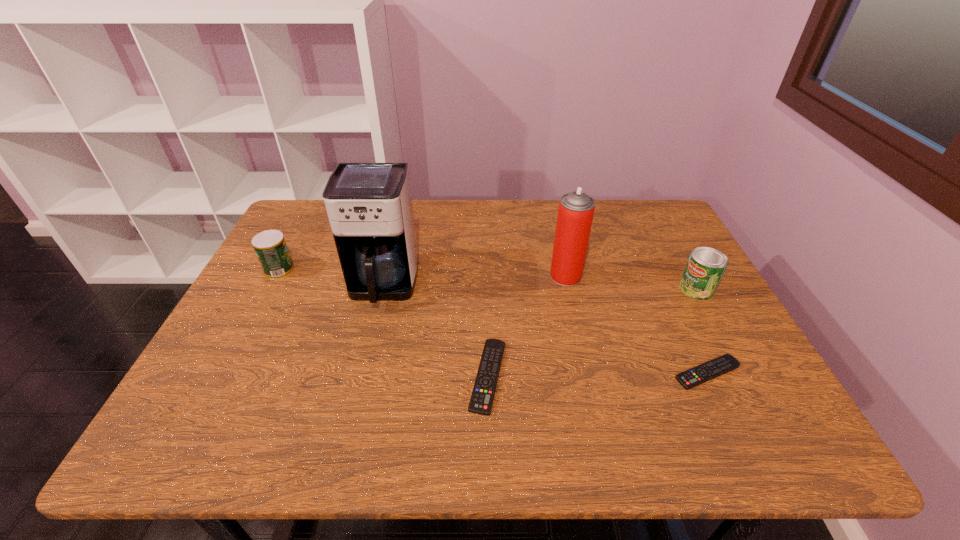
The image size is (960, 540). Identify the location of the taller remote control. (483, 393).

Find the location of a particular element. The height and width of the screenshot is (540, 960). the second shortest object is located at coordinates (483, 393).

Locate an element on the screen. The width and height of the screenshot is (960, 540). the right remote control is located at coordinates (707, 371).

At what (x,y) coordinates should I click in order to perform the action: click on the shortest object. Please return your answer as a coordinate pair (x, y). This screenshot has width=960, height=540. Looking at the image, I should click on (707, 371).

Where is `coffee maker`? coffee maker is located at coordinates (369, 205).

This screenshot has height=540, width=960. I want to click on the fifth shortest object, so click(x=576, y=209).

The image size is (960, 540). I want to click on the fourth object from left to right, so click(x=576, y=209).

Image resolution: width=960 pixels, height=540 pixels. Find the location of `the right can`. the right can is located at coordinates (706, 266).

What are the coordinates of `the leftmost object` in the screenshot? It's located at (271, 249).

The width and height of the screenshot is (960, 540). What are the coordinates of `vacant space situated 0.160m on the right of the second shortest object` in the screenshot? It's located at (578, 376).